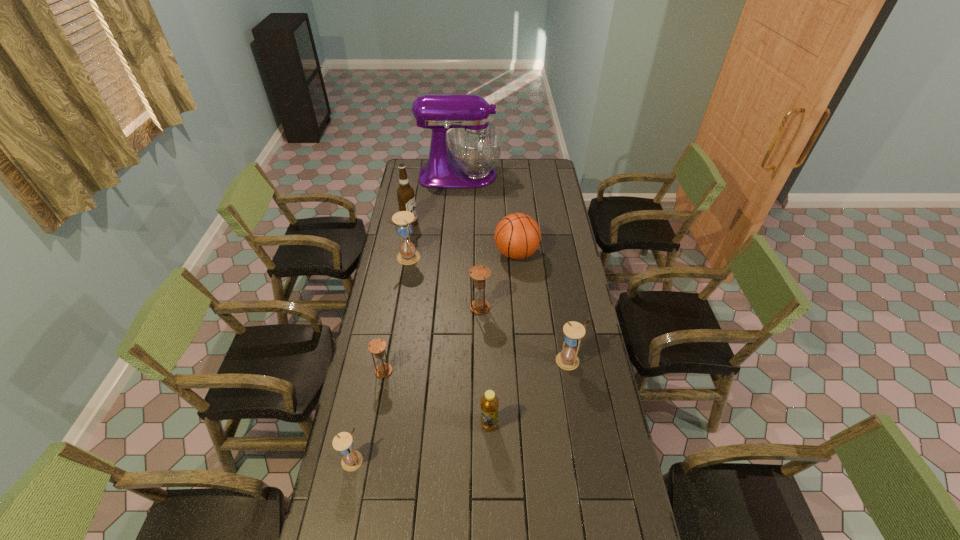
This screenshot has width=960, height=540. In order to click on the rightmost hourglass in this screenshot , I will do `click(567, 359)`.

Locate an element on the screen. This screenshot has height=540, width=960. bottle is located at coordinates (489, 403).

The width and height of the screenshot is (960, 540). Find the location of `the left brown hourglass`. the left brown hourglass is located at coordinates (377, 346).

You are a GUI agent. You are given a task and a screenshot of the screen. Output one action in this format:
    pyautogui.click(x=<x>, y=<y>)
    Task: Click on the smaller brown hourglass
    
    Given the screenshot: What is the action you would take?
    pyautogui.click(x=377, y=346)

Where is `the nearest white hourglass`? The width and height of the screenshot is (960, 540). the nearest white hourglass is located at coordinates (351, 460).

Locate an element on the screen. the smallest white hourglass is located at coordinates (351, 460).

Where is `free region located 0.180m at the bowl opening of the farthest object`? This screenshot has width=960, height=540. free region located 0.180m at the bowl opening of the farthest object is located at coordinates (533, 176).

Identify the location of vacant space located 0.080m on the label of the second tallest object. (433, 224).

At what (x,y) coordinates should I click in order to perform the action: click on free location located on the front of the farthest white hourglass. Please return your answer as a coordinate pair (x, y). Looking at the image, I should click on (400, 298).

Locate an element on the screen. The height and width of the screenshot is (540, 960). free region located 0.210m on the back of the basketball is located at coordinates (513, 214).